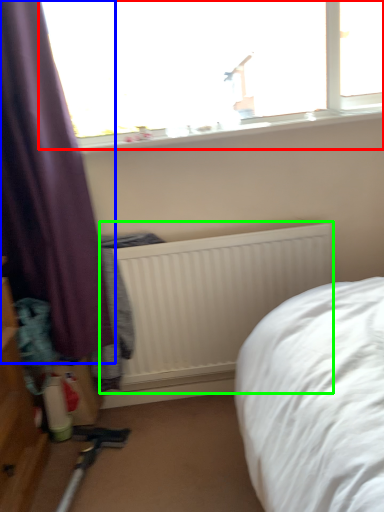
Question: Which object is positioned farthest from window (highlighted by a red box)? Select from curtain (highlighted by a blue box) and radiator (highlighted by a green box).

Choices:
 (A) curtain
 (B) radiator

Answer: (B)